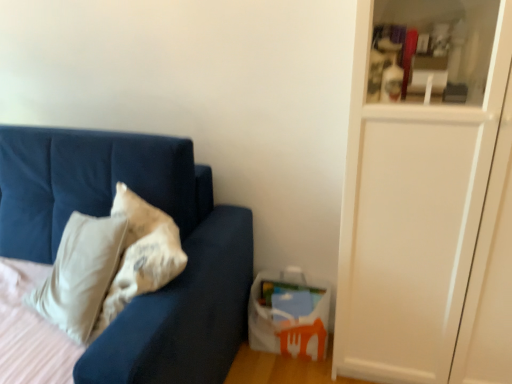
Question: Is transparent glass cabinet at right beside velvet blue couch at left?

Choices:
 (A) yes
 (B) no

Answer: (B)

Question: From the image's perspective, is transparent glass cabinet at right below velvet blue couch at left?

Choices:
 (A) yes
 (B) no

Answer: (B)

Question: From the image's perspective, is transparent glass cabinet at right above velvet blue couch at left?

Choices:
 (A) no
 (B) yes

Answer: (B)

Question: From a real-world perspective, is transparent glass cabinet at right positioned under velvet blue couch at left based on gravity?

Choices:
 (A) no
 (B) yes

Answer: (A)

Question: From a real-world perspective, is transparent glass cabinet at right positioned over velvet blue couch at left based on gravity?

Choices:
 (A) yes
 (B) no

Answer: (A)

Question: Considering the relative sizes of transparent glass cabinet at right and velvet blue couch at left in the image provided, is transparent glass cabinet at right taller than velvet blue couch at left?

Choices:
 (A) no
 (B) yes

Answer: (B)

Question: Considering the relative sizes of velvet blue couch at left and transparent glass cabinet at right in the image provided, is velvet blue couch at left smaller than transparent glass cabinet at right?

Choices:
 (A) no
 (B) yes

Answer: (A)

Question: Does velvet blue couch at left have a greater height compared to transparent glass cabinet at right?

Choices:
 (A) no
 (B) yes

Answer: (A)

Question: From the image's perspective, is velvet blue couch at left located above transparent glass cabinet at right?

Choices:
 (A) yes
 (B) no

Answer: (B)

Question: Considering the relative sizes of velvet blue couch at left and transparent glass cabinet at right in the image provided, is velvet blue couch at left wider than transparent glass cabinet at right?

Choices:
 (A) no
 (B) yes

Answer: (B)

Question: Would you say velvet blue couch at left contains transparent glass cabinet at right?

Choices:
 (A) no
 (B) yes

Answer: (A)

Question: Is the surface of velvet blue couch at left in direct contact with transparent glass cabinet at right?

Choices:
 (A) yes
 (B) no

Answer: (B)

Question: In the image, is transparent glass cabinet at right positioned in front of or behind velvet blue couch at left?

Choices:
 (A) front
 (B) behind

Answer: (B)